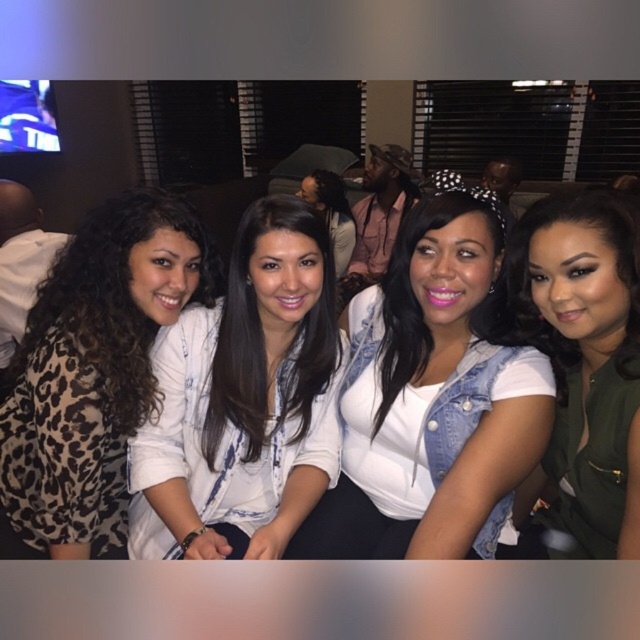
Who is higher up, white printed shirt at center or leopard print top at left?

leopard print top at left

From the picture: Can you confirm if white printed shirt at center is shorter than leopard print top at left?

Yes.

Describe the element at coordinates (243, 394) in the screenshot. I see `white printed shirt at center` at that location.

You are a GUI agent. You are given a task and a screenshot of the screen. Output one action in this format:
    pyautogui.click(x=<x>, y=<y>)
    Task: Click on the white printed shirt at center
    The height and width of the screenshot is (640, 640).
    Given the screenshot: What is the action you would take?
    pyautogui.click(x=243, y=394)

Can you confirm if denim jacket at center is positioned above white printed shirt at center?

Indeed, denim jacket at center is positioned over white printed shirt at center.

Based on the photo, can you confirm if denim jacket at center is shorter than white printed shirt at center?

No.

Locate an element on the screen. The height and width of the screenshot is (640, 640). denim jacket at center is located at coordinates (432, 397).

Consider the image. Who is positioned more to the right, leopard print top at left or green matte vest at center?

green matte vest at center

In the scene shown: Between leopard print top at left and green matte vest at center, which one has less height?

green matte vest at center is shorter.

Who is more forward, [122,401] or [621,417]?

Positioned in front is point [621,417].

At what (x,y) coordinates should I click in order to perform the action: click on leopard print top at left. Please return your answer as a coordinate pair (x, y). Looking at the image, I should click on 93,368.